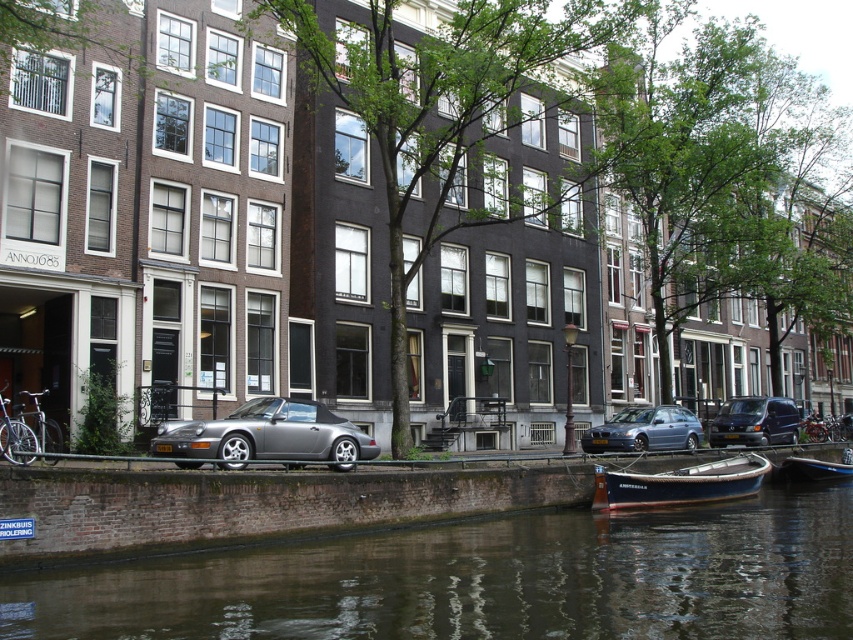
You are a delivery driver who needs to park your 2.5 meter wide van in this scene. You see the satin silver car at center and the wooden boat at lower right. Which parking spot between them has enough width for your van?

The satin silver car at center is wider than the wooden boat at lower right, so the parking spot next to the satin silver car at center has enough width for your van since it can accommodate a 2.5 meter wide vehicle.

You are a tourist in Amsterdam and want to take a photo of the wooden boat at lower right without the dark brown water at lower center in the frame. Based on their sizes, is it possible to do so?

The dark brown water at lower center is larger than the wooden boat at lower right. Since the water is bigger, it might be challenging to exclude it entirely from the photo frame if the boat is positioned near it. However, adjusting the camera angle or zoom could help focus solely on the wooden boat at lower right while minimizing the water visibility.

You are a delivery person who needs to park your vehicle in this area. The parking spot you want is located at coordinates point 0.673, 0.756. Is the satin silver car at center currently occupying that spot?

The satin silver car at center is positioned at point (643, 429), so yes, it is occupying that parking spot.